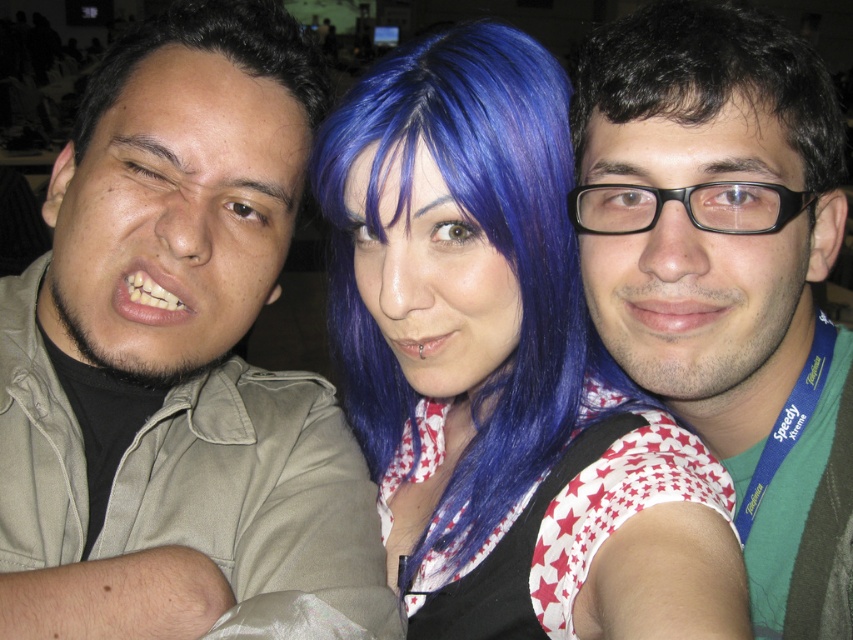
You are a photographer trying to adjust the lighting for a group photo. You notice the matte khaki shirt at center and the dark brown shiny hair at center. Which object might require more careful lighting to avoid glare?

The dark brown shiny hair at center might require more careful lighting to avoid glare since it is shinier than the matte khaki shirt at center.

You are taking a photo of three people standing in a line. You notice two points marked in the image. The first point is at coordinate point (757, 22) and the second point is at coordinate point (112, 52). Based on their positions, which point is closer to the camera?

Point (757, 22) is closer to the camera than point (112, 52).

You are taking a photo of three people standing in a line. You notice two points marked in the image, one at point (x=294, y=547) and another at point (x=819, y=164). Which point is closer to the camera?

Point (x=294, y=547) is closer to the camera than point (x=819, y=164).